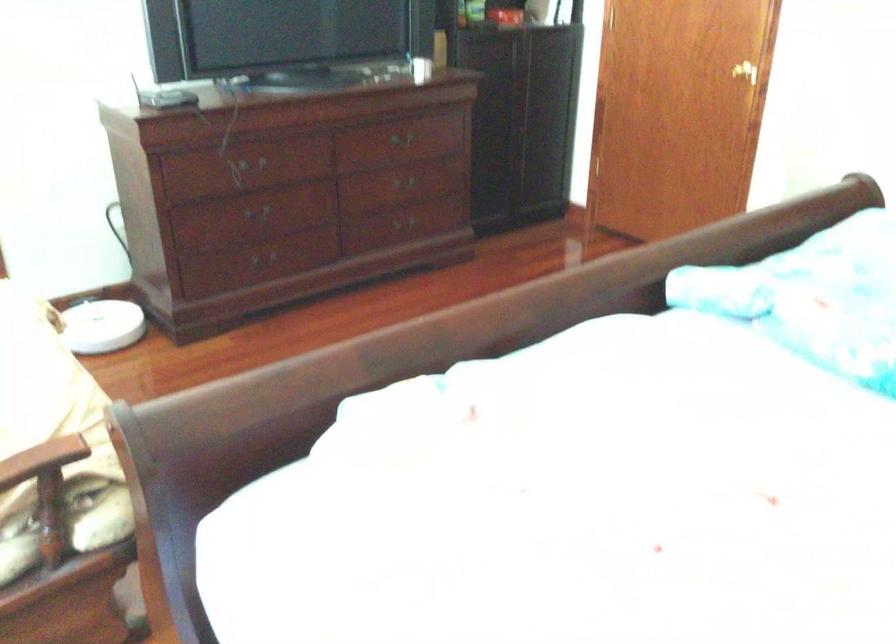
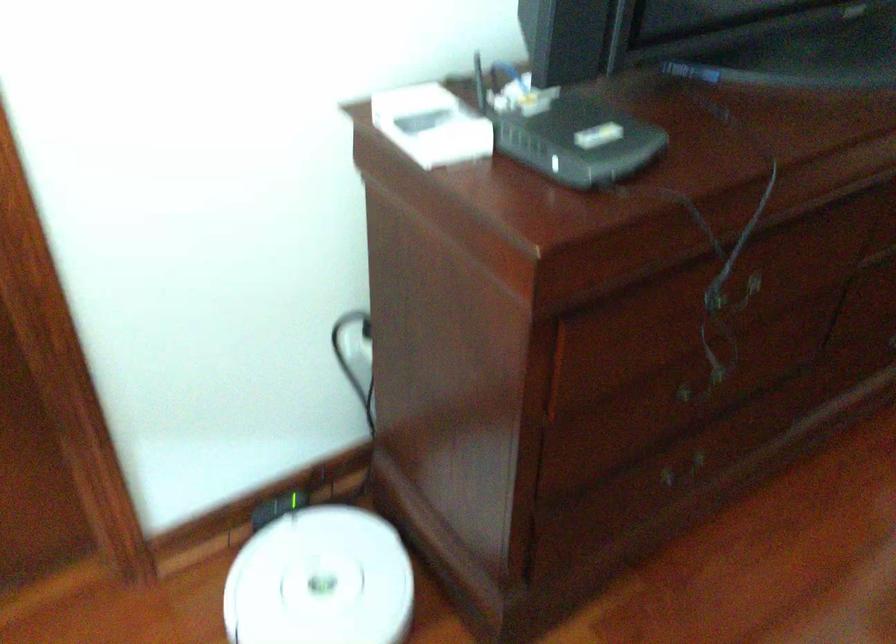
Where in the second image is the point corresponding to the point at 116,91 from the first image?

(431, 125)